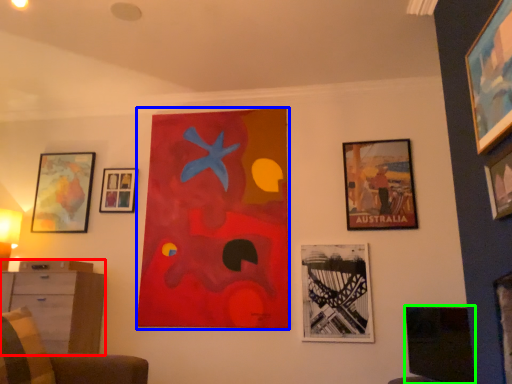
Question: Considering the real-world distances, which object is farthest from dresser (highlighted by a red box)? picture frame (highlighted by a blue box) or picture frame (highlighted by a green box)?

Choices:
 (A) picture frame
 (B) picture frame

Answer: (B)